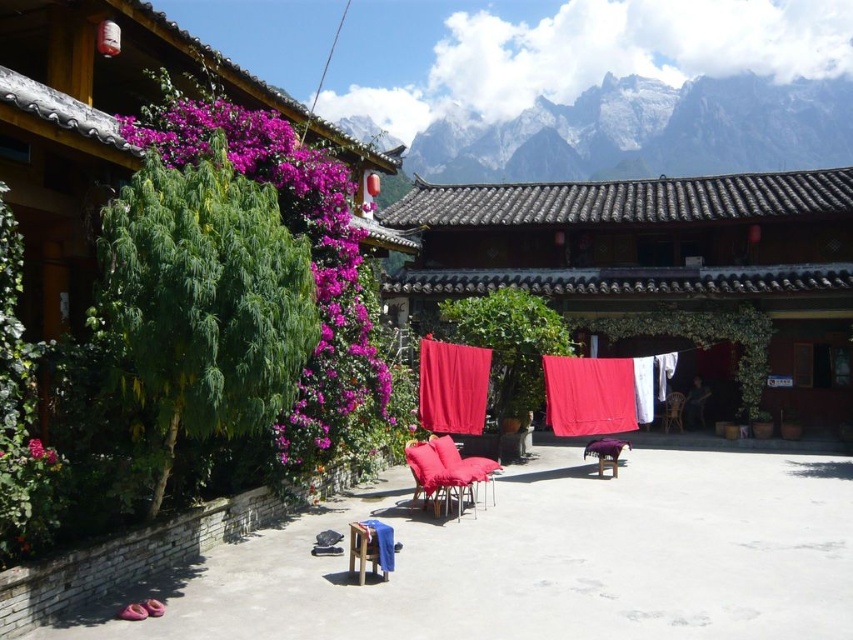
You are standing in the courtyard and want to locate the red cushioned chair. According to the scene description, where is the red cushioned chair positioned relative to the point marked at coordinates (451, 387)?

The red cushioned chair is positioned next to the small wooden table, which is near the point marked at coordinates (451, 387).

You are standing in the courtyard and want to move from the white rocky mountain at upper center to the matte red armchair at center. Which direction should you move in relation to the objects?

Since the white rocky mountain at upper center is closer to you than the matte red armchair at center, you should move away from the white rocky mountain at upper center towards the matte red armchair at center.